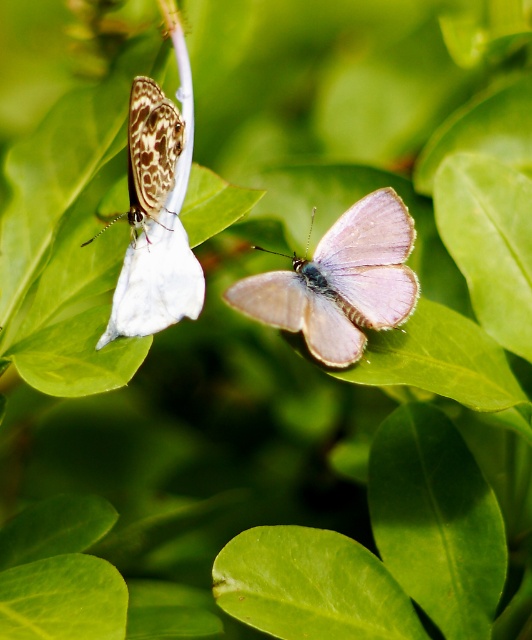
Question: Which object is positioned farthest from the pale purple iridescent wing at center?

Choices:
 (A) white matte paper at left
 (B) green smooth leaf at center
 (C) speckled brown butterfly at upper left

Answer: (B)

Question: Based on their relative distances, which object is farther from the pale purple iridescent wing at center?

Choices:
 (A) green smooth leaf at lower left
 (B) speckled brown butterfly at upper left
 (C) green smooth leaf at center

Answer: (A)

Question: Estimate the real-world distances between objects in this image. Which object is closer to the speckled brown butterfly at upper left?

Choices:
 (A) pale purple iridescent wing at center
 (B) green smooth leaf at lower left
 (C) green smooth leaf at center
 (D) white matte paper at left

Answer: (D)

Question: Can you confirm if green smooth leaf at lower left is thinner than speckled brown butterfly at upper left?

Choices:
 (A) yes
 (B) no

Answer: (B)

Question: Can you confirm if white matte paper at left is smaller than green smooth leaf at lower left?

Choices:
 (A) yes
 (B) no

Answer: (B)

Question: Does pale purple iridescent wing at center have a greater width compared to green smooth leaf at center?

Choices:
 (A) no
 (B) yes

Answer: (A)